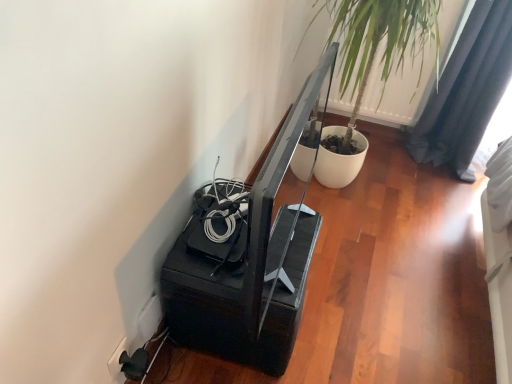
This screenshot has width=512, height=384. I want to click on vacant region under dark gray fabric curtain at upper right (from a real-world perspective), so click(436, 163).